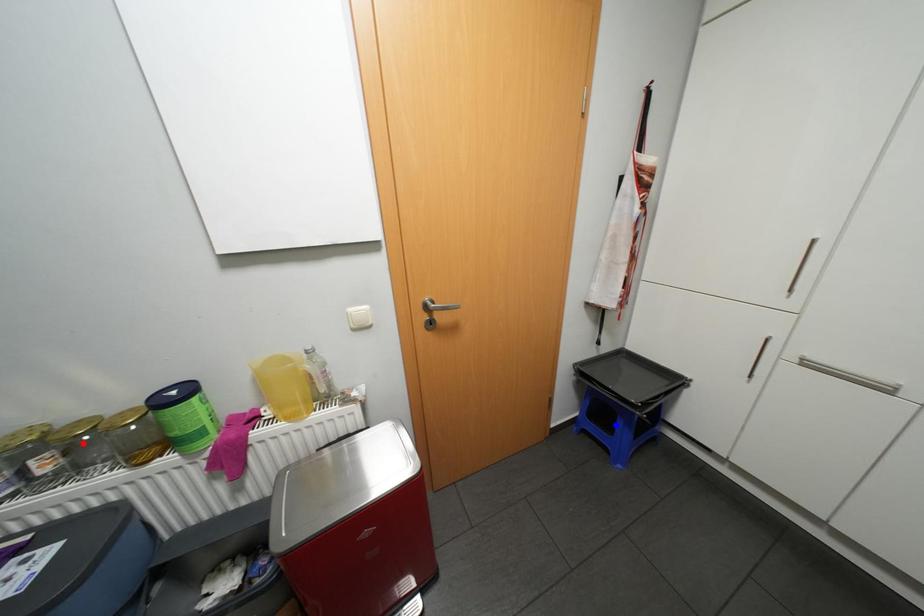
Question: Two points are marked on the image. Which point is closer to the camera?

Choices:
 (A) Blue point is closer.
 (B) Red point is closer.

Answer: (B)